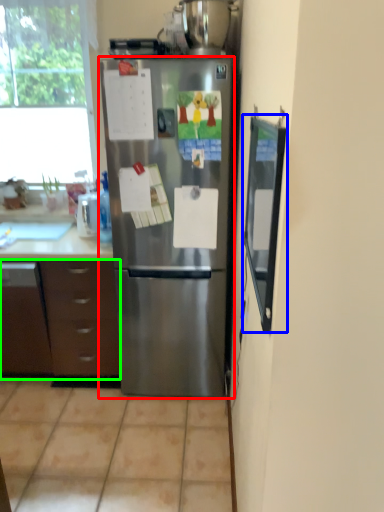
Question: Considering the real-world distances, which object is closest to refrigerator (highlighted by a red box)? screen door (highlighted by a blue box) or cabinetry (highlighted by a green box).

Choices:
 (A) screen door
 (B) cabinetry

Answer: (B)